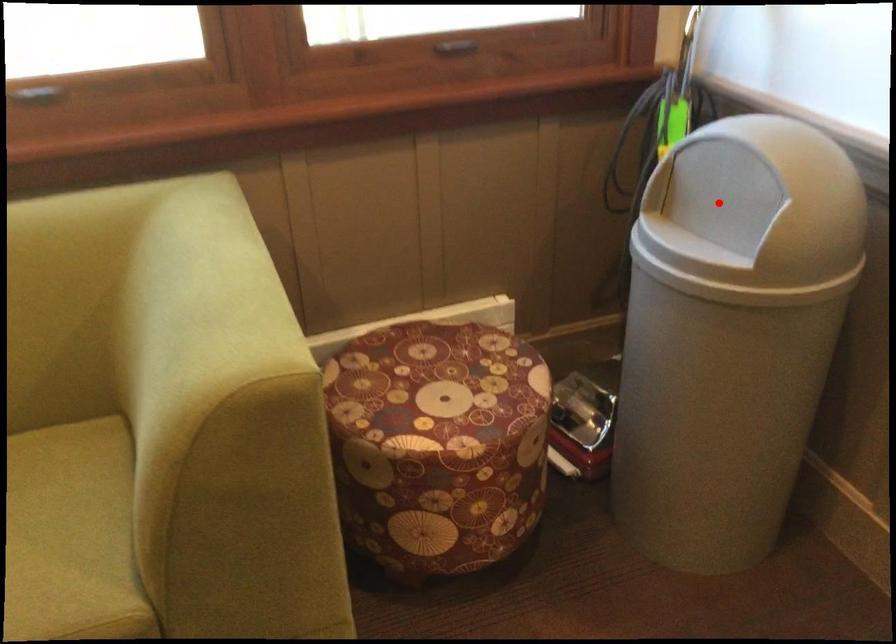
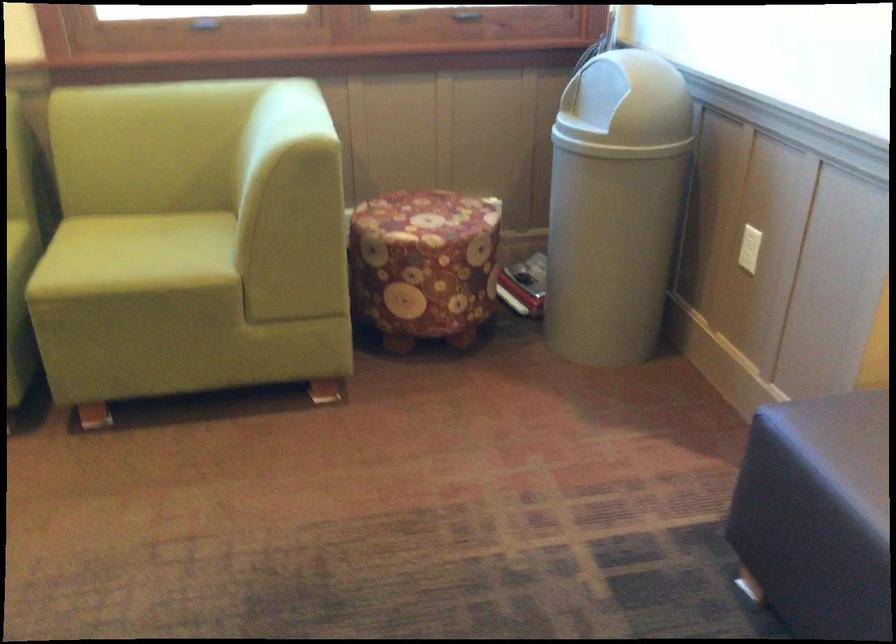
The point at the highlighted location is marked in the first image. Where is the corresponding point in the second image?

(598, 99)